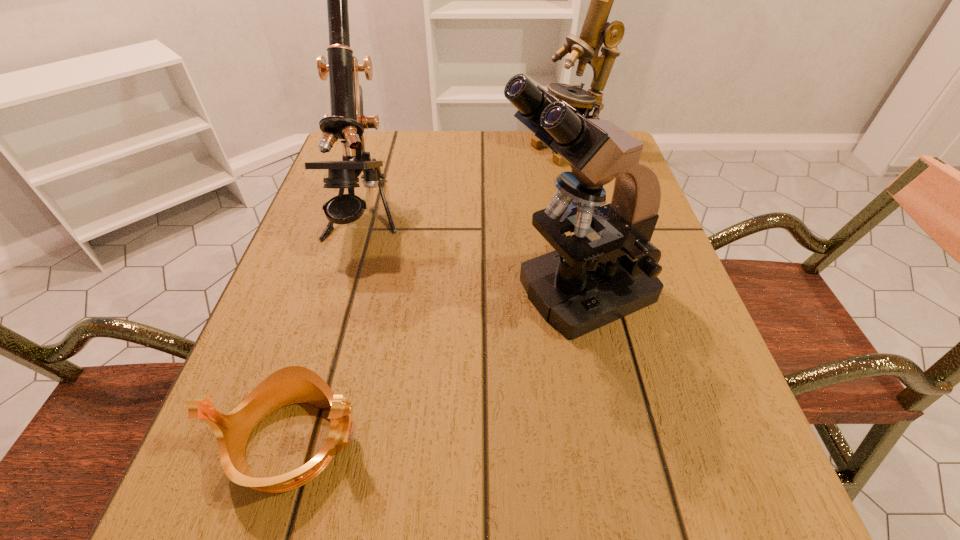
This screenshot has height=540, width=960. What are the coordinates of `free space between the tiara and the farthest microscope` in the screenshot? It's located at (431, 295).

This screenshot has height=540, width=960. Find the location of `free point between the leftmost microscope and the tiara`. free point between the leftmost microscope and the tiara is located at coordinates (329, 329).

Locate an element on the screen. vacant point located between the leftmost microscope and the farthest microscope is located at coordinates (467, 183).

I want to click on the closest object to the leftmost microscope, so click(606, 270).

You are a GUI agent. You are given a task and a screenshot of the screen. Output one action in this format:
    pyautogui.click(x=<x>, y=<y>)
    Task: Click on the object that is the second closest to the farthest microscope
    
    Given the screenshot: What is the action you would take?
    pyautogui.click(x=347, y=122)

Image resolution: width=960 pixels, height=540 pixels. I want to click on microscope that stands as the closest to the farthest microscope, so click(606, 270).

You are a GUI agent. You are given a task and a screenshot of the screen. Output one action in this format:
    pyautogui.click(x=<x>, y=<y>)
    Task: Click on the microscope that stands as the closest to the leftmost microscope
    
    Given the screenshot: What is the action you would take?
    pyautogui.click(x=606, y=270)

The height and width of the screenshot is (540, 960). What are the coordinates of `blank space that satisfies the following two spatial constraints: 1. on the front side of the farthest microscope; 2. at the front emblem of the tiara` in the screenshot? It's located at 647,442.

You are a GUI agent. You are given a task and a screenshot of the screen. Output one action in this format:
    pyautogui.click(x=<x>, y=<y>)
    Task: Click on the vacant space that satisfies the following two spatial constraints: 1. through the eyepiece of the leftmost microscope; 2. at the front emblem of the nearest object
    The image size is (960, 540).
    Given the screenshot: What is the action you would take?
    pyautogui.click(x=300, y=442)